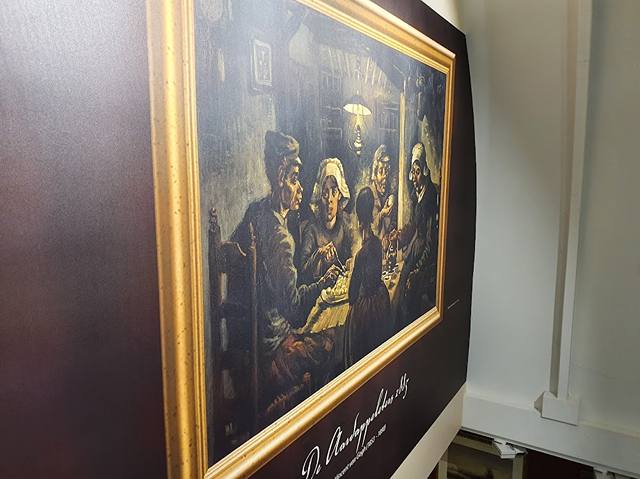
You are a GUI agent. You are given a task and a screenshot of the screen. Output one action in this format:
    pyautogui.click(x=<x>, y=<y>)
    Task: Click on the wooden table
    
    Given the screenshot: What is the action you would take?
    pyautogui.click(x=331, y=314)